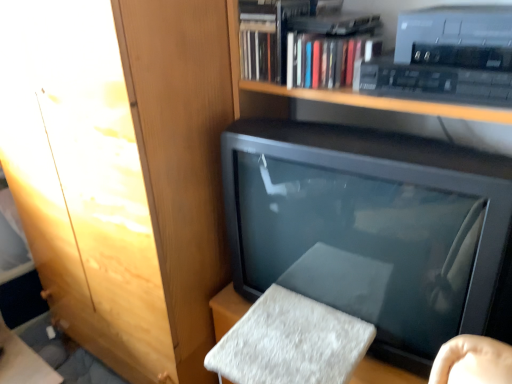
Question: From the image's perspective, would you say wooden cabinet at upper left is shown under matte black television at center?

Choices:
 (A) no
 (B) yes

Answer: (A)

Question: Is wooden cabinet at upper left shorter than matte black television at center?

Choices:
 (A) yes
 (B) no

Answer: (B)

Question: Does wooden cabinet at upper left appear on the right side of matte black television at center?

Choices:
 (A) yes
 (B) no

Answer: (B)

Question: Is wooden cabinet at upper left at the left side of matte black television at center?

Choices:
 (A) no
 (B) yes

Answer: (B)

Question: Can you confirm if wooden cabinet at upper left is smaller than matte black television at center?

Choices:
 (A) no
 (B) yes

Answer: (A)

Question: Is point (310, 72) closer or farther from the camera than point (418, 329)?

Choices:
 (A) farther
 (B) closer

Answer: (A)

Question: From a real-world perspective, is hardcover book at upper center positioned above or below matte black television at center?

Choices:
 (A) above
 (B) below

Answer: (A)

Question: Is hardcover book at upper center spatially inside matte black television at center, or outside of it?

Choices:
 (A) inside
 (B) outside

Answer: (B)

Question: From the image's perspective, relative to matte black television at center, is hardcover book at upper center above or below?

Choices:
 (A) below
 (B) above

Answer: (B)

Question: Is matte black television at center taller or shorter than hardcover book at upper center?

Choices:
 (A) tall
 (B) short

Answer: (A)

Question: From the image's perspective, is matte black television at center above or below hardcover book at upper center?

Choices:
 (A) above
 (B) below

Answer: (B)

Question: Based on their sizes in the image, would you say matte black television at center is bigger or smaller than hardcover book at upper center?

Choices:
 (A) small
 (B) big

Answer: (B)

Question: In the image, is matte black television at center positioned in front of or behind hardcover book at upper center?

Choices:
 (A) behind
 (B) front

Answer: (B)

Question: Is hardcover book at upper center to the left or to the right of wooden cabinet at upper left in the image?

Choices:
 (A) right
 (B) left

Answer: (A)

Question: Choose the correct answer: Is hardcover book at upper center inside wooden cabinet at upper left or outside it?

Choices:
 (A) outside
 (B) inside

Answer: (A)